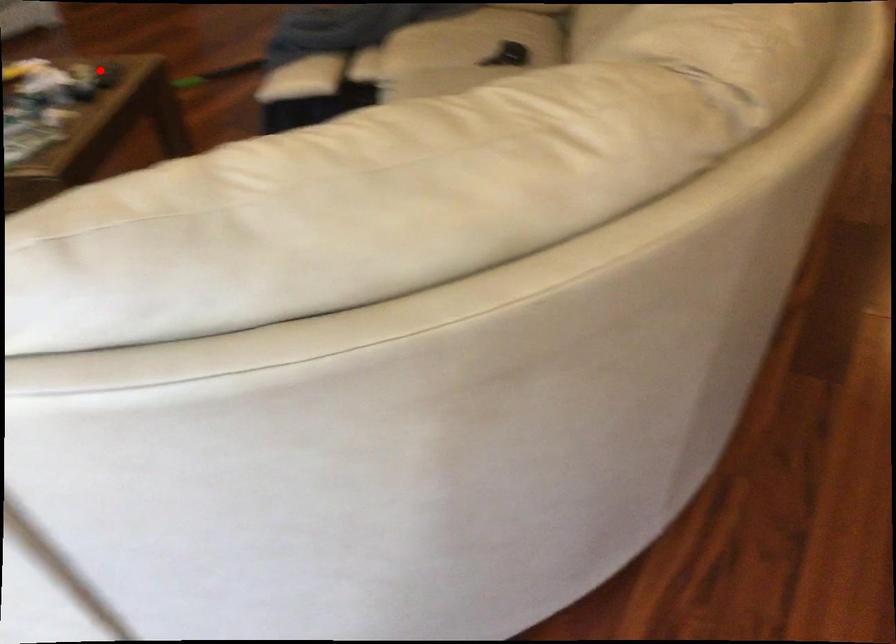
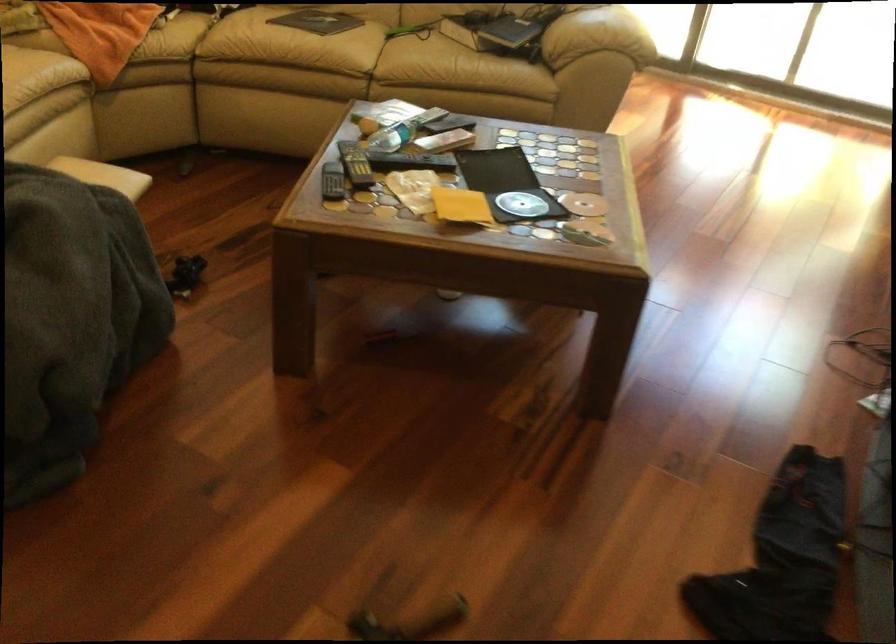
The point at the highlighted location is marked in the first image. Where is the corresponding point in the second image?

(332, 182)